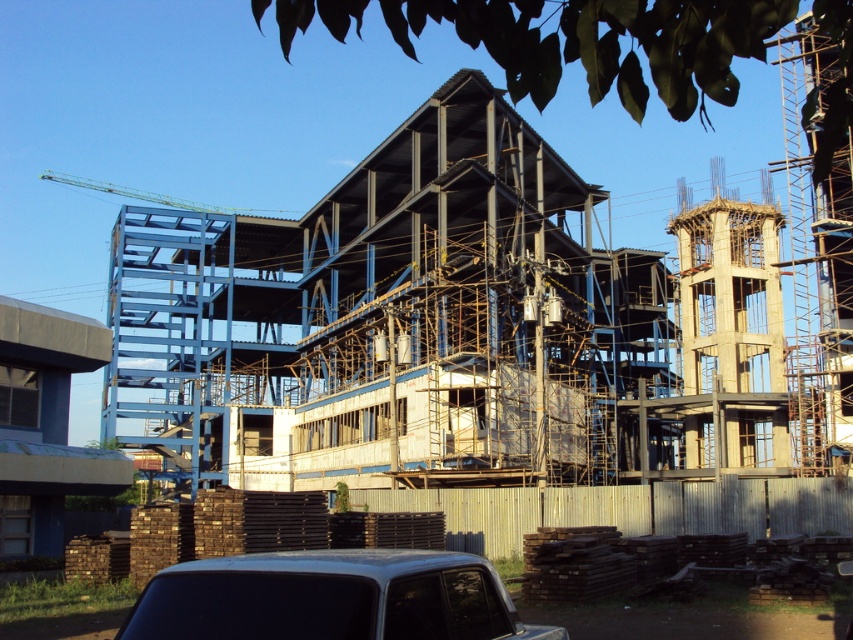
Question: Which point appears farthest from the camera in this image?

Choices:
 (A) (190, 202)
 (B) (422, 605)

Answer: (A)

Question: Does silver metallic car at lower center appear under green metallic crane at upper left?

Choices:
 (A) yes
 (B) no

Answer: (A)

Question: Which point is closer to the camera taking this photo?

Choices:
 (A) (210, 625)
 (B) (213, 211)

Answer: (A)

Question: Does silver metallic car at lower center appear on the right side of green metallic crane at upper left?

Choices:
 (A) no
 (B) yes

Answer: (B)

Question: Can you confirm if silver metallic car at lower center is positioned below green metallic crane at upper left?

Choices:
 (A) yes
 (B) no

Answer: (A)

Question: Among these objects, which one is farthest from the camera?

Choices:
 (A) silver metallic car at lower center
 (B) green metallic crane at upper left

Answer: (B)